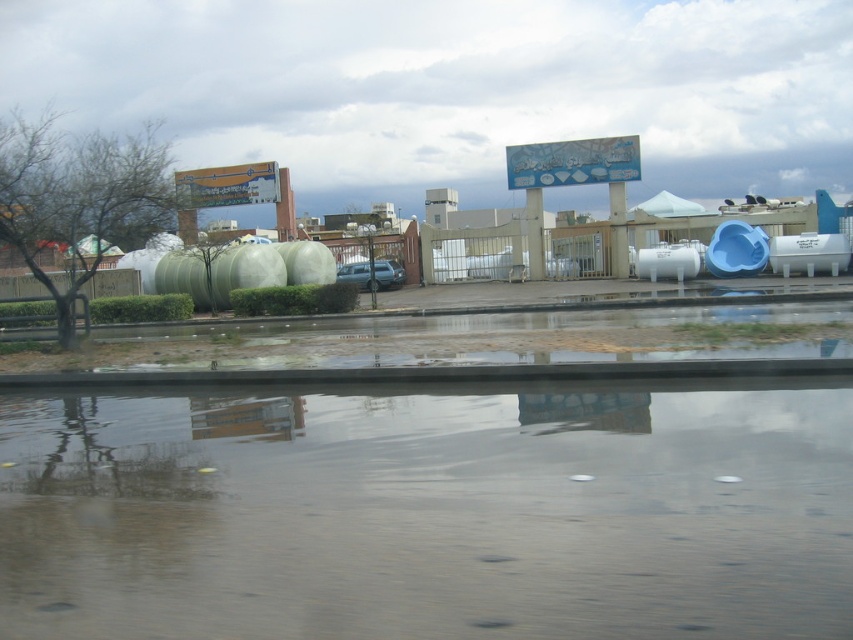
You are a delivery drone flying over an urban area with a wingspan of 1 meter. You need to pass between the transparent water at lower center and the blue plastic slide at right to reach your destination. Can you fit through the space between them?

The transparent water at lower center has a lesser width compared to the blue plastic slide at right. Since the water is narrower, the space between them may be sufficient for the drone to pass through if the width difference allows for clearance. However, the exact dimensions aren

You are standing on the dock and want to walk to the blue plastic slide at right. Which direction should you move relative to the transparent water at lower center?

You should move to the right of the transparent water at lower center to reach the blue plastic slide at right since the transparent water at lower center is to the left of blue plastic slide at right.

You are a photographer trying to capture the reflection of the blue plastic slide at right in the transparent water at lower center. Based on the scene, can you confirm if the water is wide enough to fully reflect the slide?

The transparent water at lower center occupies less space than blue plastic slide at right, so the water may not be wide enough to fully reflect the slide.